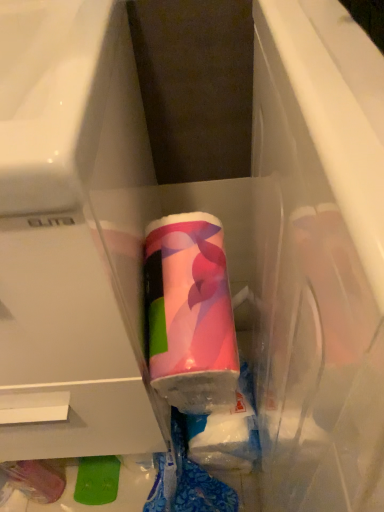
Question: Is matte plastic drawer at center turned away from pink glossy tube at center?

Choices:
 (A) yes
 (B) no

Answer: (B)

Question: Is matte plastic drawer at center smaller than pink glossy tube at center?

Choices:
 (A) no
 (B) yes

Answer: (A)

Question: Does matte plastic drawer at center have a lesser height compared to pink glossy tube at center?

Choices:
 (A) no
 (B) yes

Answer: (A)

Question: Is matte plastic drawer at center oriented towards pink glossy tube at center?

Choices:
 (A) no
 (B) yes

Answer: (A)

Question: Is the depth of matte plastic drawer at center greater than that of pink glossy tube at center?

Choices:
 (A) yes
 (B) no

Answer: (B)

Question: Is matte plastic drawer at center wider than pink glossy tube at center?

Choices:
 (A) yes
 (B) no

Answer: (A)

Question: Is pink glossy tube at center aimed at matte plastic drawer at center?

Choices:
 (A) no
 (B) yes

Answer: (A)

Question: Can you see pink glossy tube at center touching matte plastic drawer at center?

Choices:
 (A) yes
 (B) no

Answer: (A)

Question: Considering the relative positions of pink glossy tube at center and matte plastic drawer at center in the image provided, is pink glossy tube at center in front of matte plastic drawer at center?

Choices:
 (A) no
 (B) yes

Answer: (A)

Question: From the image's perspective, is pink glossy tube at center on matte plastic drawer at center?

Choices:
 (A) yes
 (B) no

Answer: (B)

Question: Is pink glossy tube at center wider than matte plastic drawer at center?

Choices:
 (A) yes
 (B) no

Answer: (B)

Question: Is matte plastic drawer at center located within pink glossy tube at center?

Choices:
 (A) yes
 (B) no

Answer: (B)

Question: Considering the positions of pink glossy tube at center and matte plastic drawer at center in the image, is pink glossy tube at center taller or shorter than matte plastic drawer at center?

Choices:
 (A) tall
 (B) short

Answer: (B)